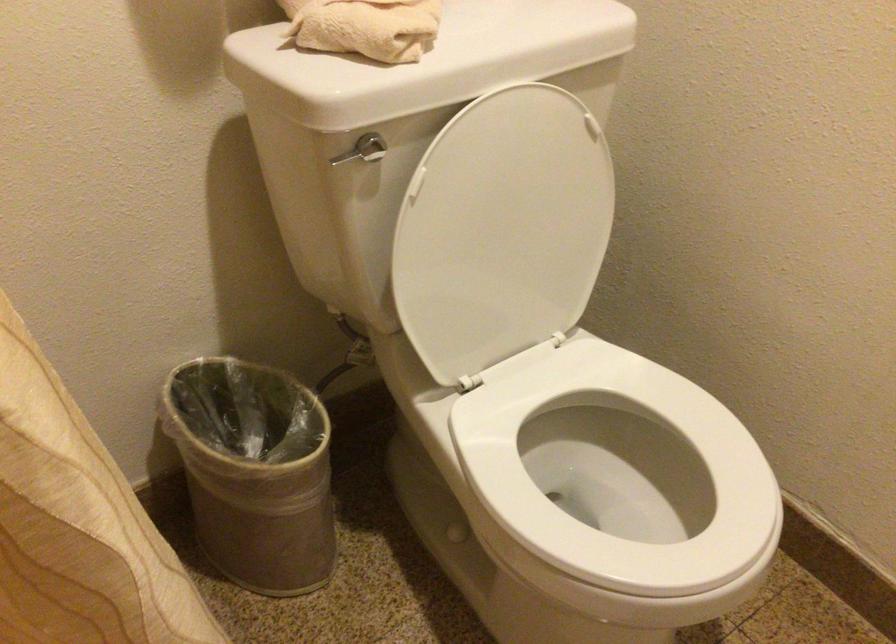
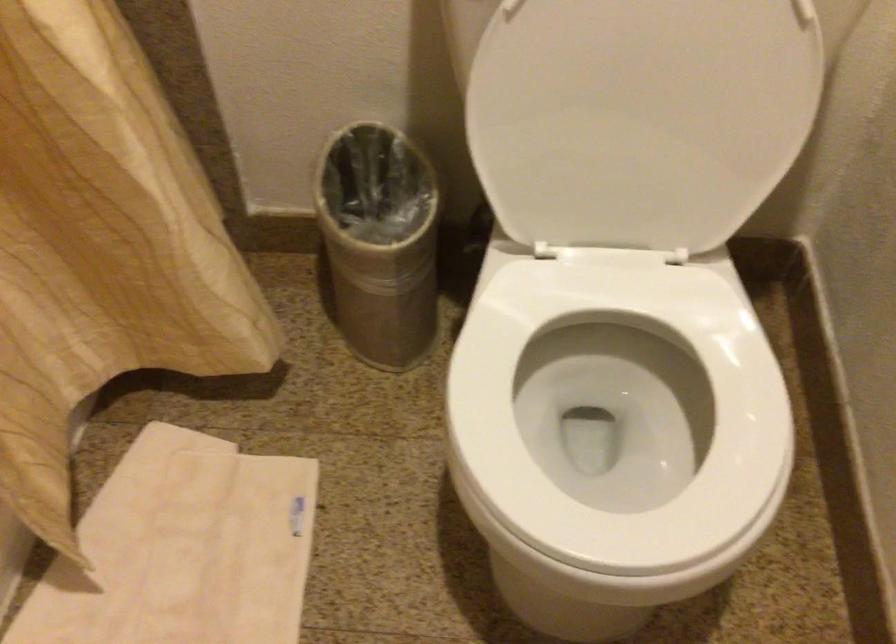
In the second image, find the point that corresponds to point 306,457 in the first image.

(380, 242)